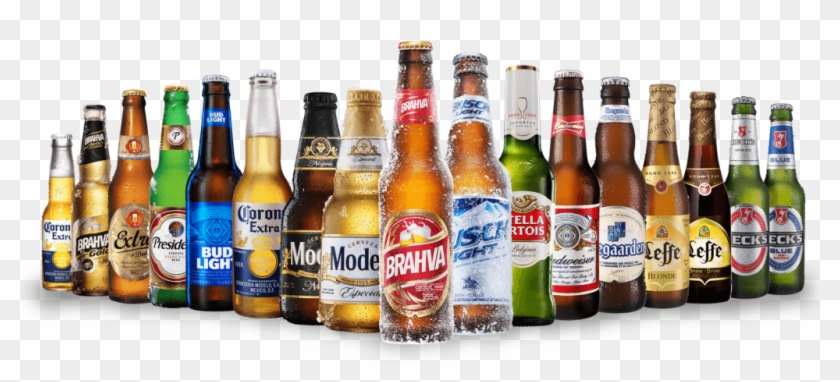
At what (x,y) coordinates should I click in order to perform the action: click on green glass. Please return your answer as a coordinate pair (x, y). Looking at the image, I should click on (172, 196), (526, 175), (751, 178), (786, 174).